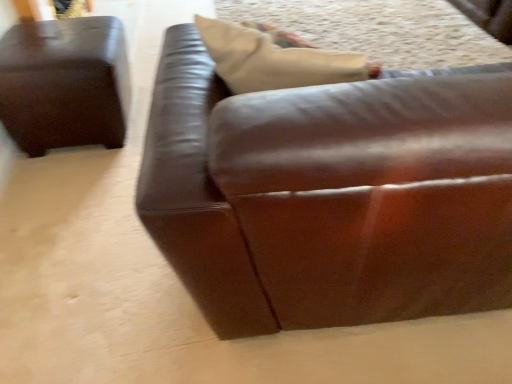
Question: Relative to brown leather ottoman at left, marked as the first studio couch in a left-to-right arrangement, is brown leather couch at center, which is the 2th studio couch in left-to-right order, in front or behind?

Choices:
 (A) front
 (B) behind

Answer: (A)

Question: Considering the positions of brown leather couch at center, which is the 2th studio couch in left-to-right order, and brown leather ottoman at left, marked as the first studio couch in a left-to-right arrangement, in the image, is brown leather couch at center, which is the 2th studio couch in left-to-right order, bigger or smaller than brown leather ottoman at left, marked as the first studio couch in a left-to-right arrangement,?

Choices:
 (A) big
 (B) small

Answer: (A)

Question: Is brown leather couch at center, the 1th studio couch when ordered from right to left, spatially inside brown leather ottoman at left, which appears as the 2th studio couch when viewed from the right, or outside of it?

Choices:
 (A) inside
 (B) outside

Answer: (B)

Question: In terms of height, does brown leather ottoman at left, marked as the first studio couch in a left-to-right arrangement, look taller or shorter compared to brown leather couch at center, the 1th studio couch when ordered from right to left?

Choices:
 (A) short
 (B) tall

Answer: (A)

Question: Considering the relative positions of brown leather ottoman at left, marked as the first studio couch in a left-to-right arrangement, and brown leather couch at center, which is the 2th studio couch in left-to-right order, in the image provided, is brown leather ottoman at left, marked as the first studio couch in a left-to-right arrangement, to the left or to the right of brown leather couch at center, which is the 2th studio couch in left-to-right order,?

Choices:
 (A) right
 (B) left

Answer: (B)

Question: From the image's perspective, relative to brown leather couch at center, the 1th studio couch when ordered from right to left, is brown leather ottoman at left, which appears as the 2th studio couch when viewed from the right, above or below?

Choices:
 (A) below
 (B) above

Answer: (B)

Question: From a real-world perspective, is brown leather ottoman at left, which appears as the 2th studio couch when viewed from the right, positioned above or below brown leather couch at center, the 1th studio couch when ordered from right to left?

Choices:
 (A) below
 (B) above

Answer: (A)